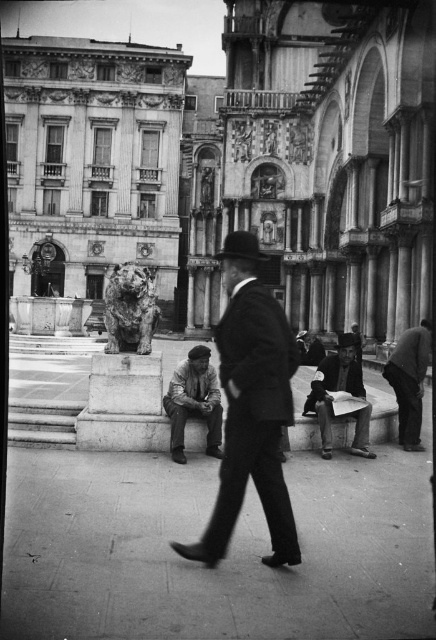
Question: Does smooth concrete pavement at center have a greater width compared to smooth black suit at center?

Choices:
 (A) yes
 (B) no

Answer: (A)

Question: Is smooth concrete pavement at center to the left of smooth black suit at center from the viewer's perspective?

Choices:
 (A) no
 (B) yes

Answer: (B)

Question: Which point is closer to the camera taking this photo?

Choices:
 (A) (275, 328)
 (B) (330, 420)

Answer: (A)

Question: Among these objects, which one is nearest to the camera?

Choices:
 (A) smooth paper at center
 (B) dark gray fabric coat at lower right
 (C) dark gray fabric cap at lower center
 (D) smooth black suit at center

Answer: (D)

Question: Does smooth concrete pavement at center have a lesser width compared to smooth black suit at center?

Choices:
 (A) no
 (B) yes

Answer: (A)

Question: Which of the following is the closest to the observer?

Choices:
 (A) rustic stone lion at center
 (B) dark gray fabric coat at lower right
 (C) smooth paper at center
 (D) dark gray fabric cap at lower center

Answer: (D)